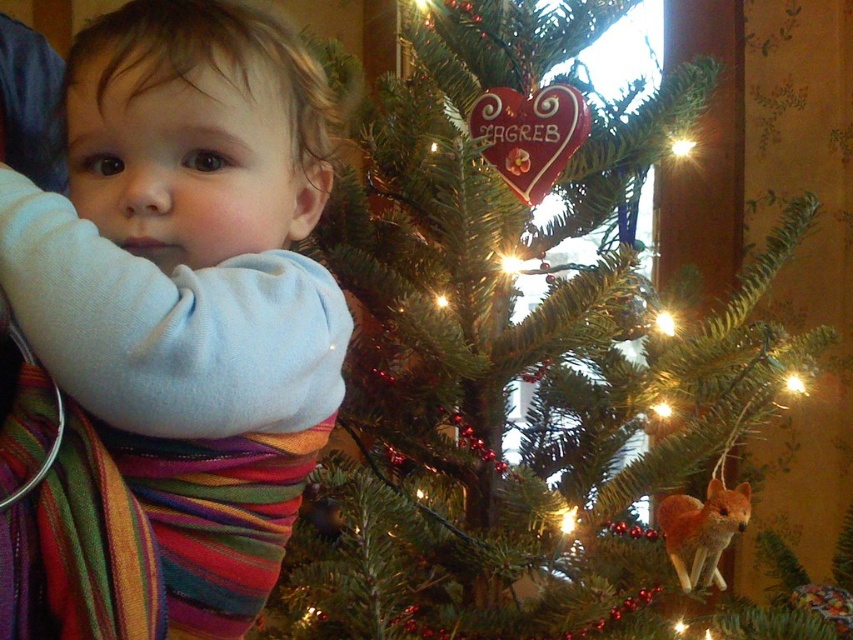
Between green matte christmas tree at center and white soft baby at center, which one is positioned higher?

Positioned higher is white soft baby at center.

Can you confirm if green matte christmas tree at center is positioned to the left of white soft baby at center?

Incorrect, green matte christmas tree at center is not on the left side of white soft baby at center.

Where is `green matte christmas tree at center`? green matte christmas tree at center is located at coordinates point(508,356).